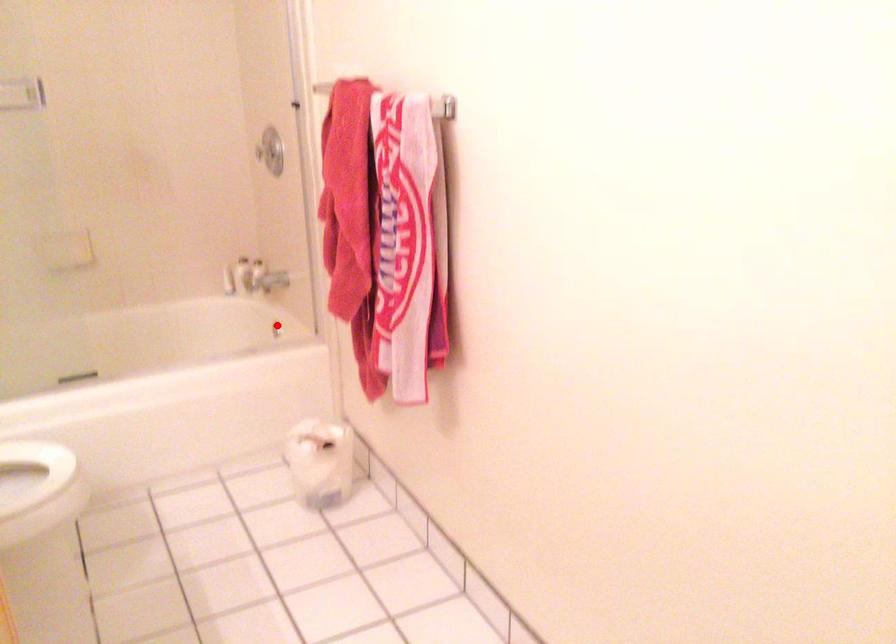
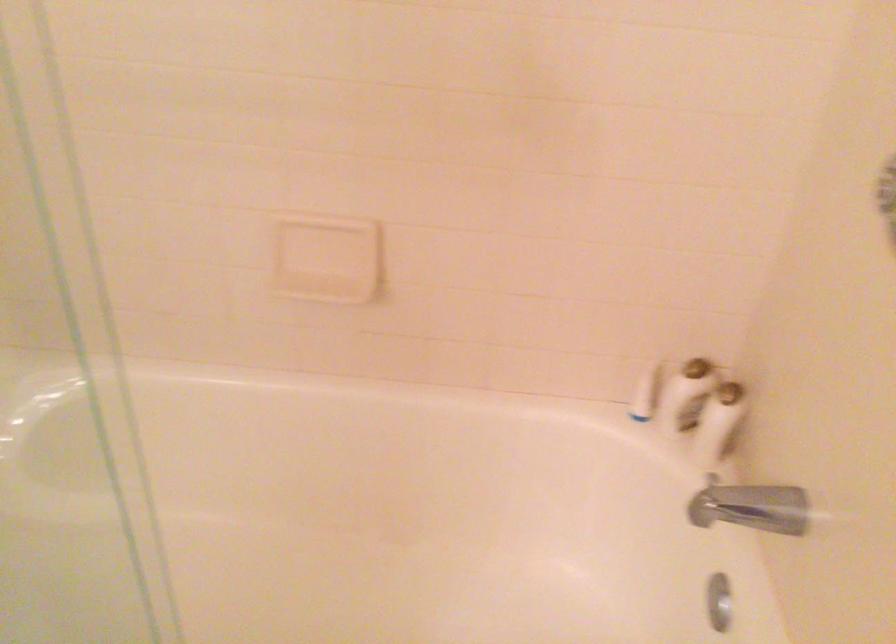
Find the pixel in the second image that matches the highlighted location in the first image.

(719, 601)